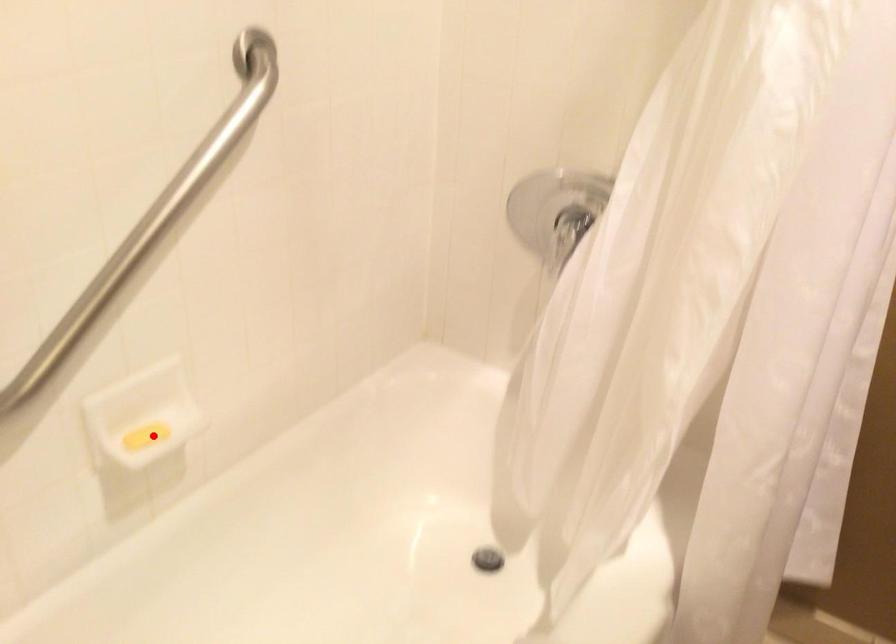
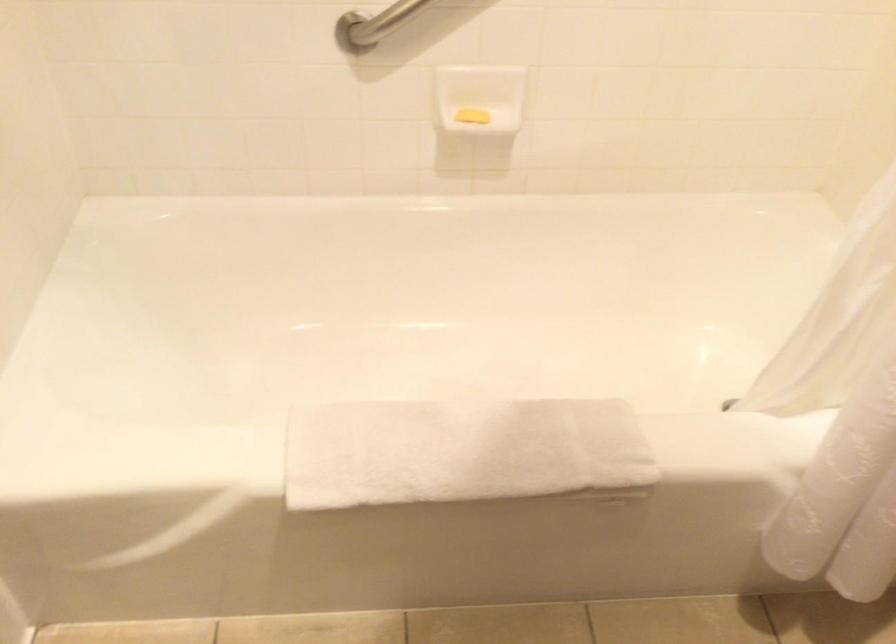
Question: I am providing you with two images of the same scene from different viewpoints. Image1 has a red point marked. In image2, the corresponding 3D location appears at what relative position? Reply with the corresponding letter.

Choices:
 (A) Closer
 (B) Farther

Answer: (B)